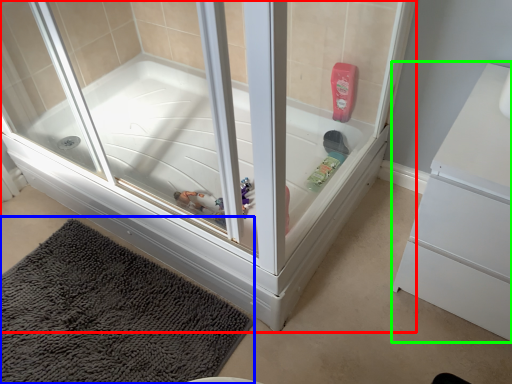
Question: Based on their relative distances, which object is nearer to bathtub (highlighted by a red box)? Choose from bath mat (highlighted by a blue box) and dresser (highlighted by a green box).

Choices:
 (A) bath mat
 (B) dresser

Answer: (A)